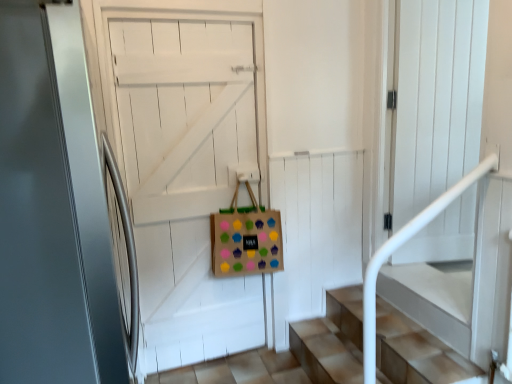
Question: Does wooden door at center, arranged as the 1th door when viewed from the back, have a greater width compared to satin white door at center, marked as the 1th door in a front-to-back arrangement?

Choices:
 (A) yes
 (B) no

Answer: (B)

Question: From a real-world perspective, does wooden door at center, the second door from the front, stand above satin white door at center, positioned as the second door in back-to-front order?

Choices:
 (A) no
 (B) yes

Answer: (A)

Question: Does wooden door at center, arranged as the 1th door when viewed from the back, have a greater height compared to satin white door at center, positioned as the second door in back-to-front order?

Choices:
 (A) yes
 (B) no

Answer: (B)

Question: Is wooden door at center, arranged as the 1th door when viewed from the back, aimed at satin white door at center, marked as the 1th door in a front-to-back arrangement?

Choices:
 (A) no
 (B) yes

Answer: (A)

Question: Considering the relative positions of wooden door at center, the second door from the front, and satin white door at center, marked as the 1th door in a front-to-back arrangement, in the image provided, is wooden door at center, the second door from the front, in front of satin white door at center, marked as the 1th door in a front-to-back arrangement,?

Choices:
 (A) no
 (B) yes

Answer: (A)

Question: Is satin white door at center, marked as the 1th door in a front-to-back arrangement, to the left or to the right of wooden door at center, arranged as the 1th door when viewed from the back, in the image?

Choices:
 (A) left
 (B) right

Answer: (A)

Question: Is point (64, 340) closer or farther from the camera than point (160, 193)?

Choices:
 (A) closer
 (B) farther

Answer: (A)

Question: Is satin white door at center, marked as the 1th door in a front-to-back arrangement, inside or outside of wooden door at center, arranged as the 1th door when viewed from the back?

Choices:
 (A) outside
 (B) inside

Answer: (A)

Question: From the image's perspective, is satin white door at center, positioned as the second door in back-to-front order, above or below wooden door at center, the second door from the front?

Choices:
 (A) above
 (B) below

Answer: (A)

Question: Does point (280, 238) appear closer or farther from the camera than point (65, 23)?

Choices:
 (A) closer
 (B) farther

Answer: (B)

Question: In terms of width, does brown paper bag with colorful cupcake stickers at center look wider or thinner when compared to satin white door at center, positioned as the second door in back-to-front order?

Choices:
 (A) wide
 (B) thin

Answer: (B)

Question: Do you think brown paper bag with colorful cupcake stickers at center is within satin white door at center, positioned as the second door in back-to-front order, or outside of it?

Choices:
 (A) inside
 (B) outside

Answer: (B)

Question: From a real-world perspective, relative to satin white door at center, positioned as the second door in back-to-front order, is brown paper bag with colorful cupcake stickers at center vertically above or below?

Choices:
 (A) above
 (B) below

Answer: (B)

Question: Looking at their shapes, would you say satin white door at center, positioned as the second door in back-to-front order, is wider or thinner than brown paper bag with colorful cupcake stickers at center?

Choices:
 (A) thin
 (B) wide

Answer: (B)

Question: In terms of height, does satin white door at center, positioned as the second door in back-to-front order, look taller or shorter compared to brown paper bag with colorful cupcake stickers at center?

Choices:
 (A) short
 (B) tall

Answer: (B)